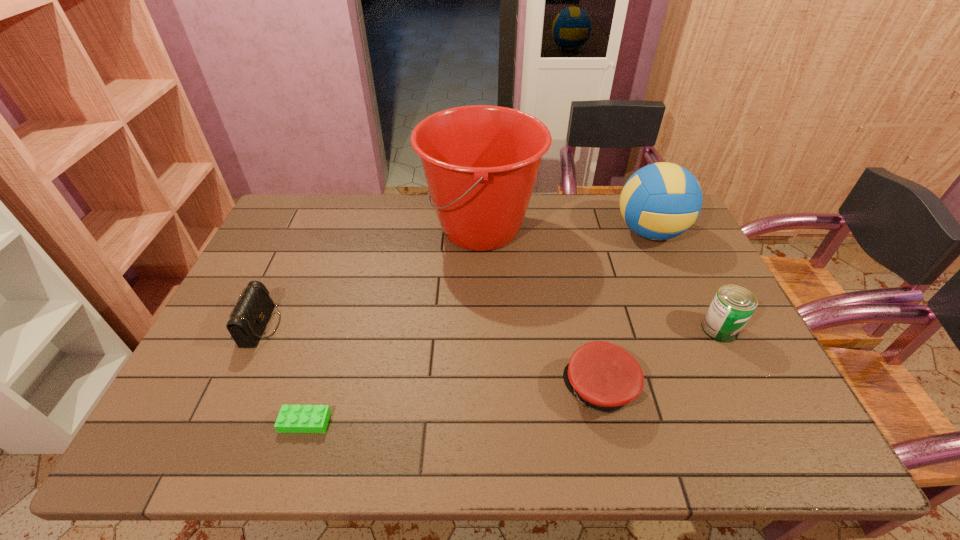
You are a GUI agent. You are given a task and a screenshot of the screen. Output one action in this format:
    pyautogui.click(x=<x>, y=<y>)
    Task: Click on the free space located with the handle attached to the rim of the bucket
    Image resolution: width=960 pixels, height=540 pixels.
    Given the screenshot: What is the action you would take?
    pyautogui.click(x=329, y=229)

The image size is (960, 540). I want to click on vacant space located on the front of the second tallest object, so click(690, 322).

At what (x,y) coordinates should I click in order to perform the action: click on free space located 0.250m on the front of the can. Please return your answer as a coordinate pair (x, y). The image size is (960, 540). Looking at the image, I should click on (773, 435).

Where is `vacant space located on the front flap of the clutch bag`? This screenshot has height=540, width=960. vacant space located on the front flap of the clutch bag is located at coordinates (331, 326).

At what (x,y) coordinates should I click in order to perform the action: click on vacant space located on the front-facing side of the second shortest object. Please return your answer as a coordinate pair (x, y). Image resolution: width=960 pixels, height=540 pixels. Looking at the image, I should click on (428, 389).

You are a GUI agent. You are given a task and a screenshot of the screen. Output one action in this format:
    pyautogui.click(x=<x>, y=<y>)
    Task: Click on the free space located 0.270m on the front-facing side of the second shortest object
    
    Given the screenshot: What is the action you would take?
    pyautogui.click(x=449, y=389)

The width and height of the screenshot is (960, 540). Identify the location of free spot located 0.280m on the front-facing side of the second shortest object. (445, 389).

In order to click on vacant space situated on the back of the shortest object in this screenshot , I will do `click(342, 303)`.

Locate an element on the screen. The image size is (960, 540). bucket that is positioned at the far edge is located at coordinates (481, 162).

This screenshot has width=960, height=540. I want to click on volleyball present at the far edge, so click(660, 201).